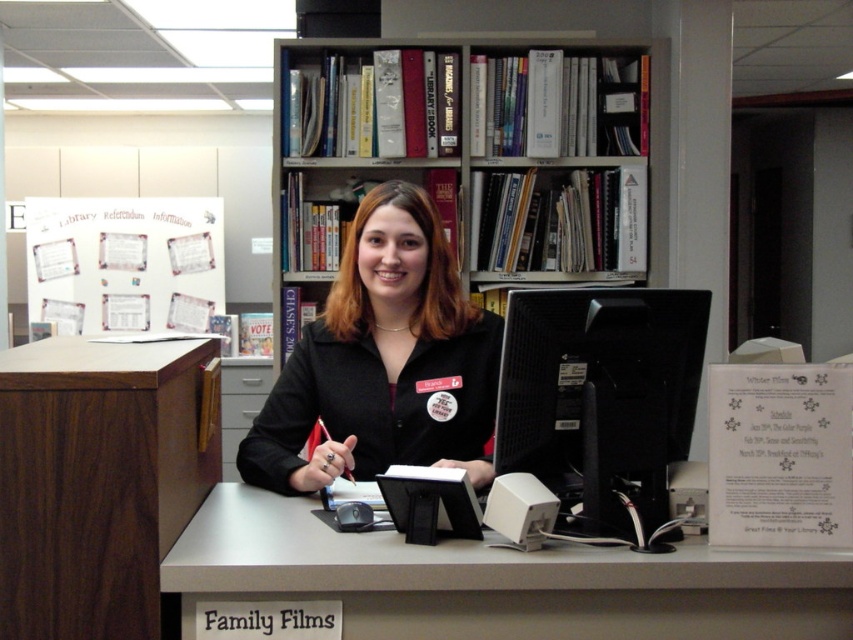
Question: Estimate the real-world distances between objects in this image. Which object is closer to the black matte monitor at center?

Choices:
 (A) walnut wood file cabinet at left
 (B) matte black jacket at center

Answer: (B)

Question: Is white plastic table at center thinner than white paper at upper left?

Choices:
 (A) no
 (B) yes

Answer: (B)

Question: Among these points, which one is farthest from the camera?

Choices:
 (A) (415, 269)
 (B) (167, 221)

Answer: (B)

Question: Observing the image, what is the correct spatial positioning of matte black jacket at center in reference to black matte monitor at center?

Choices:
 (A) right
 (B) left

Answer: (B)

Question: Does wooden bookshelf at upper center have a lesser width compared to black matte monitor at center?

Choices:
 (A) no
 (B) yes

Answer: (A)

Question: Based on their relative distances, which object is nearer to the white paper at upper left?

Choices:
 (A) white plastic table at center
 (B) walnut wood file cabinet at left
 (C) black matte monitor at center
 (D) wooden bookshelf at upper center

Answer: (D)